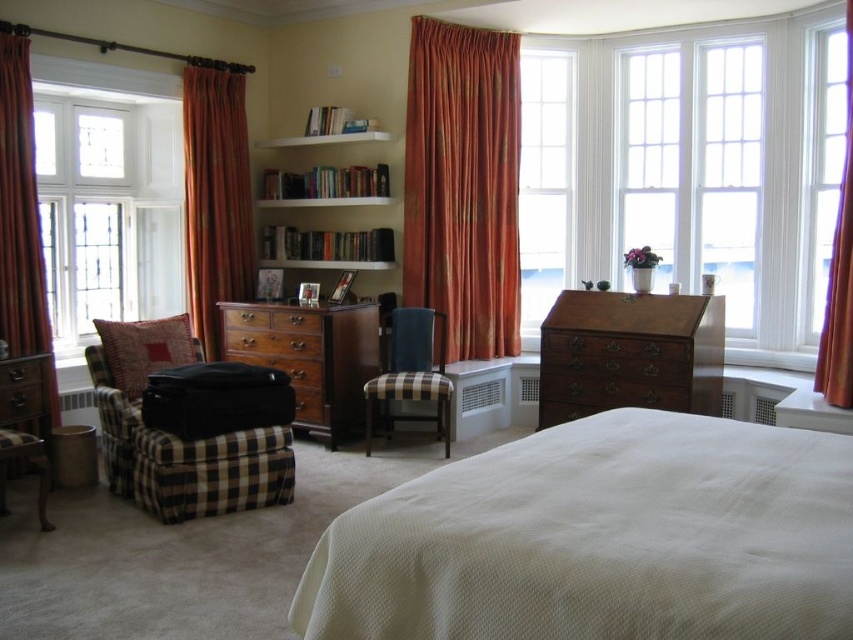
Which is in front, point (82, 252) or point (560, 292)?

Positioned in front is point (560, 292).

Identify the location of white glass window at left. The width and height of the screenshot is (853, 640). (107, 198).

Between point (167, 198) and point (544, 420), which one is positioned in front?

Point (544, 420) is in front.

Where is `white glass window at left`? white glass window at left is located at coordinates (107, 198).

Can you confirm if white wood bookshelf at center is smaller than matte brown drawer at center?

Incorrect, white wood bookshelf at center is not smaller in size than matte brown drawer at center.

Who is more distant from viewer, (280, 193) or (241, 339)?

The point (280, 193) is more distant.

Between point (368, 136) and point (283, 344), which one is positioned in front?

Positioned in front is point (283, 344).

At what (x,y) coordinates should I click in order to perform the action: click on white wood bookshelf at center. Please return your answer as a coordinate pair (x, y). Looking at the image, I should click on click(331, 211).

Is white glass window at upper right shorter than orange velvet curtain at left?

Incorrect, white glass window at upper right's height does not fall short of orange velvet curtain at left's.

Who is positioned more to the right, white glass window at upper right or orange velvet curtain at left?

From the viewer's perspective, white glass window at upper right appears more on the right side.

This screenshot has width=853, height=640. Describe the element at coordinates (694, 164) in the screenshot. I see `white glass window at upper right` at that location.

You are a GUI agent. You are given a task and a screenshot of the screen. Output one action in this format:
    pyautogui.click(x=<x>, y=<y>)
    Task: Click on the white glass window at upper right
    The width and height of the screenshot is (853, 640).
    Given the screenshot: What is the action you would take?
    pyautogui.click(x=694, y=164)